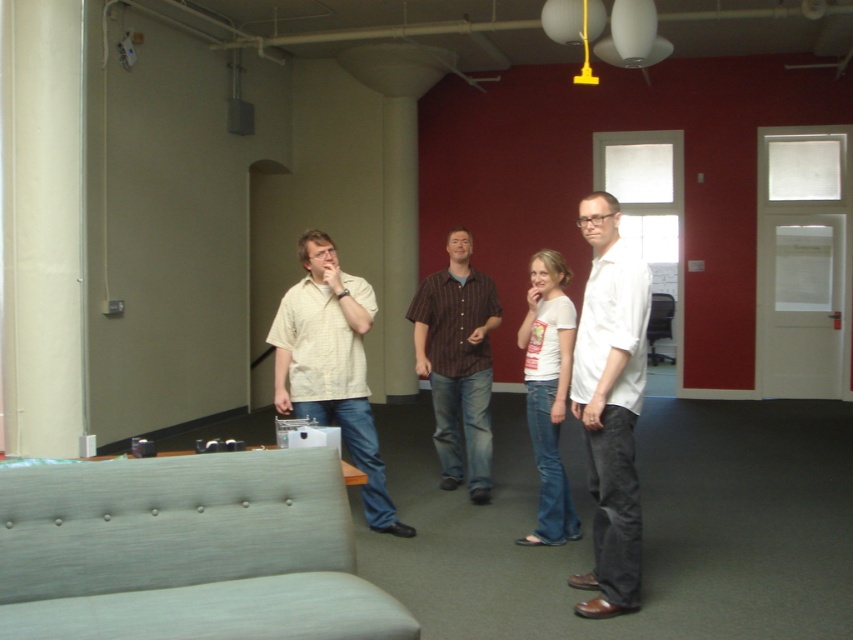
Is matte beige shirt at center taller than white cotton t-shirt at center?

Indeed, matte beige shirt at center has a greater height compared to white cotton t-shirt at center.

Does matte beige shirt at center come behind white cotton t-shirt at center?

No, it is not.

At what (x,y) coordinates should I click in order to perform the action: click on matte beige shirt at center. Please return your answer as a coordinate pair (x, y). The height and width of the screenshot is (640, 853). Looking at the image, I should click on (331, 365).

Can you confirm if white matte shirt at center is positioned above matte beige shirt at center?

Yes.

Is white matte shirt at center positioned in front of matte beige shirt at center?

Yes, white matte shirt at center is closer to the viewer.

Between point (601, 308) and point (276, 324), which one is positioned in front?

Point (601, 308) is in front.

You are a GUI agent. You are given a task and a screenshot of the screen. Output one action in this format:
    pyautogui.click(x=<x>, y=<y>)
    Task: Click on the white matte shirt at center
    The height and width of the screenshot is (640, 853).
    Given the screenshot: What is the action you would take?
    pyautogui.click(x=610, y=404)

Describe the element at coordinates (331, 365) in the screenshot. I see `matte beige shirt at center` at that location.

Does matte beige shirt at center appear on the left side of brown striped shirt at center?

Result: Indeed, matte beige shirt at center is positioned on the left side of brown striped shirt at center.

Between point (329, 241) and point (450, 259), which one is positioned behind?

The point (450, 259) is behind.

The height and width of the screenshot is (640, 853). I want to click on matte beige shirt at center, so click(x=331, y=365).